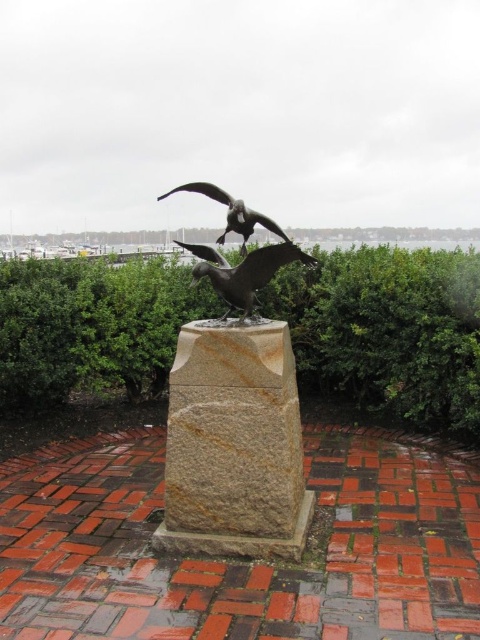
Question: Does green leafy hedge at center have a larger size compared to polished bronze bird at center?

Choices:
 (A) no
 (B) yes

Answer: (B)

Question: Is bronze statue of bird at center smaller than polished bronze bird at center?

Choices:
 (A) no
 (B) yes

Answer: (B)

Question: Which point is closer to the camera?

Choices:
 (A) bronze statue of bird at center
 (B) green leafy hedge at center
 (C) brown granite pedestal at center
 (D) polished bronze bird at center

Answer: (C)

Question: Is bronze statue of bird at center wider than polished bronze bird at center?

Choices:
 (A) no
 (B) yes

Answer: (B)

Question: Estimate the real-world distances between objects in this image. Which object is farther from the polished bronze bird at center?

Choices:
 (A) brown granite pedestal at center
 (B) green leafy hedge at center

Answer: (B)

Question: Which is farther from the bronze statue of bird at center?

Choices:
 (A) brown granite pedestal at center
 (B) polished bronze bird at center

Answer: (A)